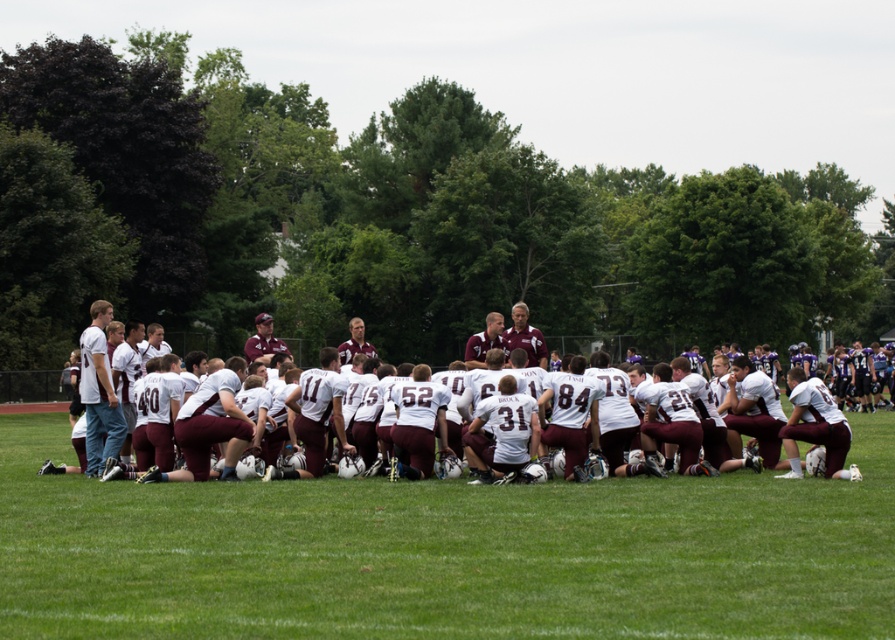
Is the position of white fabric field at center more distant than that of white matte jersey at center?

That is False.

Which of these two, white fabric field at center or white matte jersey at center, stands taller?

white matte jersey at center

Find the location of a particular element. This screenshot has height=640, width=895. white fabric field at center is located at coordinates (444, 554).